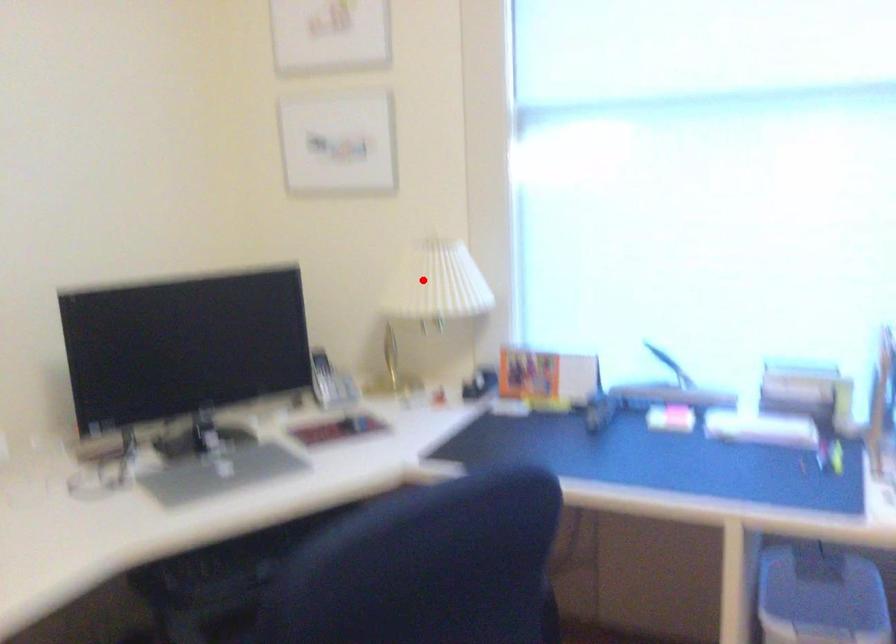
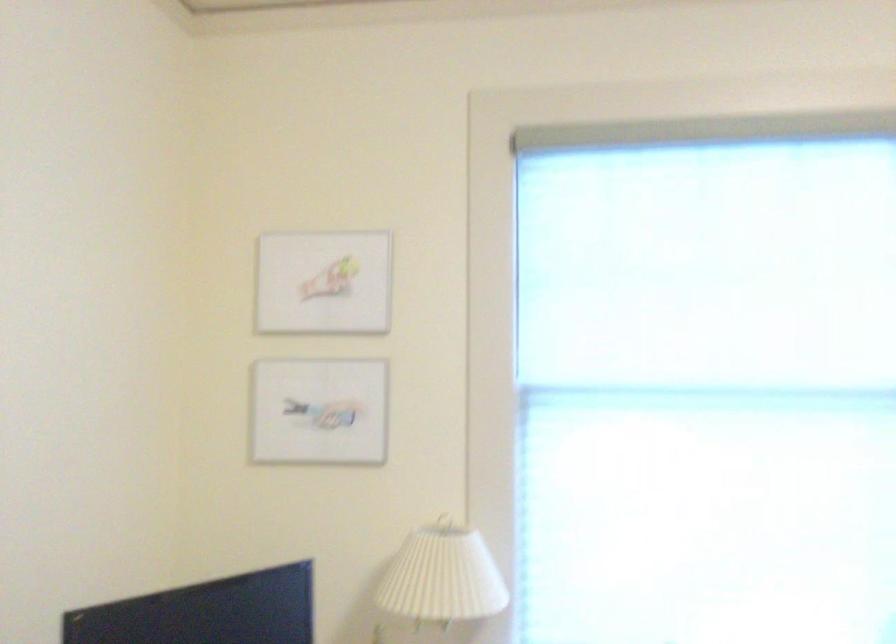
Question: I am providing you with two images of the same scene from different viewpoints. Given a red point in image1, look at the same physical point in image2. Is it:

Choices:
 (A) Closer to the viewpoint
 (B) Farther from the viewpoint

Answer: (A)